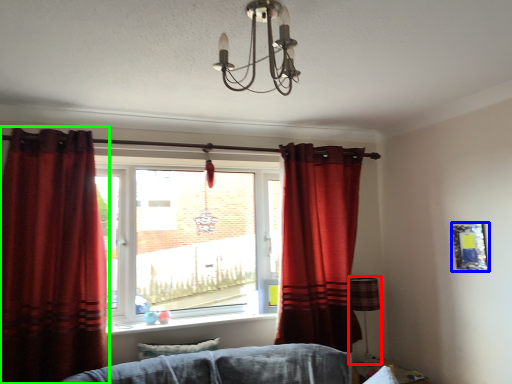
Question: Estimate the real-world distances between objects in this image. Which object is farther from lamp (highlighted by a red box), picture frame (highlighted by a blue box) or curtain (highlighted by a green box)?

Choices:
 (A) picture frame
 (B) curtain

Answer: (B)